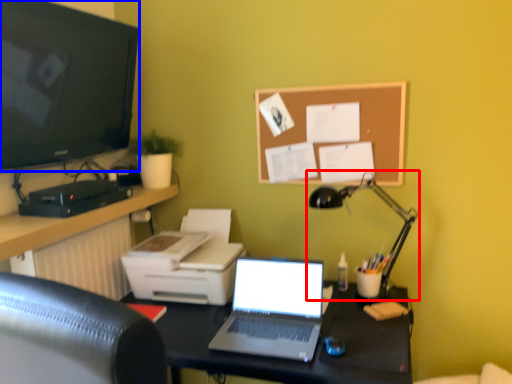
Question: Which point is closer to the camera, lamp (highlighted by a red box) or television (highlighted by a blue box)?

Choices:
 (A) lamp
 (B) television

Answer: (B)